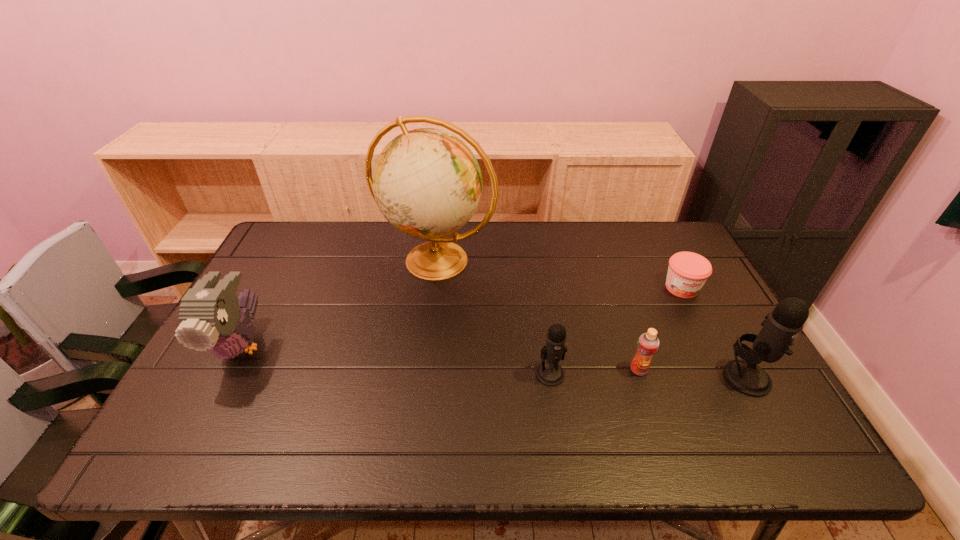
Identify the location of free area in between the jam and the second tallest object. Image resolution: width=960 pixels, height=540 pixels. (714, 333).

I want to click on vacant area between the right microphone and the fourth shortest object, so click(x=494, y=362).

Where is `free space between the tallest object and the leftmost object`? free space between the tallest object and the leftmost object is located at coordinates (339, 303).

You are a GUI agent. You are given a task and a screenshot of the screen. Output one action in this format:
    pyautogui.click(x=<x>, y=<y>)
    Task: Click on the vacant area between the second object from left to right and the jam
    This screenshot has height=540, width=960.
    Given the screenshot: What is the action you would take?
    pyautogui.click(x=559, y=274)

The height and width of the screenshot is (540, 960). Find the location of `free space between the second shortest object and the fourth shortest object`. free space between the second shortest object and the fourth shortest object is located at coordinates (440, 357).

Locate an element on the screen. The image size is (960, 540). vacant point located between the third tallest object and the fourth object from left to right is located at coordinates (440, 357).

Locate which object ranks fourth in proximity to the leftmost object. Please provide its 2D coordinates. Your answer should be formatted as a tuple, i.e. [(x, y)], where the tuple contains the x and y coordinates of a point satisfying the conditions above.

[(687, 273)]

Find the location of a particular element. The image size is (960, 540). object that can be found as the fourth closest to the globe is located at coordinates (687, 273).

Where is `vacant space that satisfies the following two spatial constraints: 1. on the front side of the tallest object; 2. on the right side of the fifth shortest object`? This screenshot has width=960, height=540. vacant space that satisfies the following two spatial constraints: 1. on the front side of the tallest object; 2. on the right side of the fifth shortest object is located at coordinates [x=422, y=377].

At what (x,y) coordinates should I click in order to perform the action: click on free space in the image that satisfies the following two spatial constraints: 1. at the beak of the fourth shortest object; 2. on the left side of the orange juice. Please return your answer as a coordinate pair (x, y). The image size is (960, 540). Looking at the image, I should click on (228, 370).